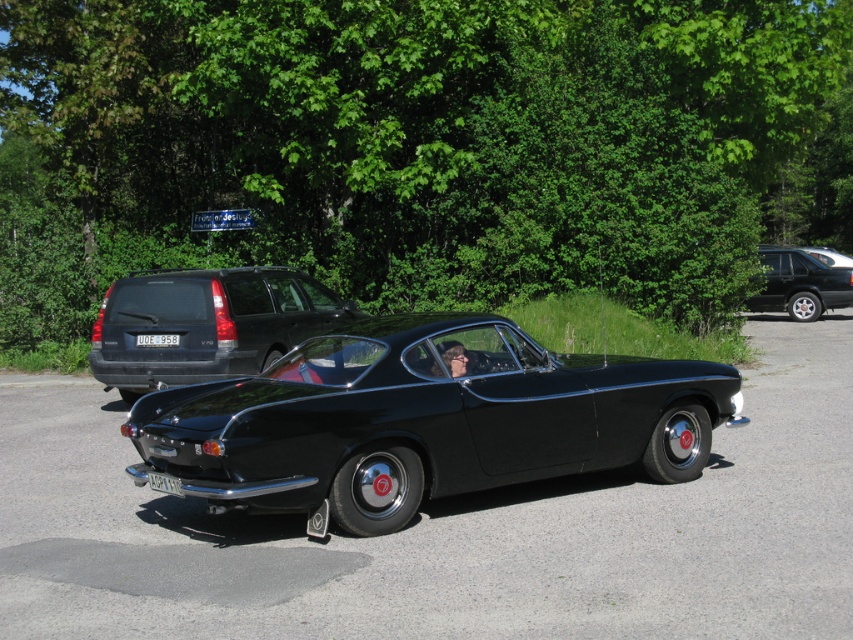
You are a delivery driver who needs to park your truck next to the black glossy car at center and the blue plastic street sign at upper center. Which object should you avoid hitting because it is wider?

You should avoid hitting the black glossy car at center because its width is larger than the blue plastic street sign at upper center.